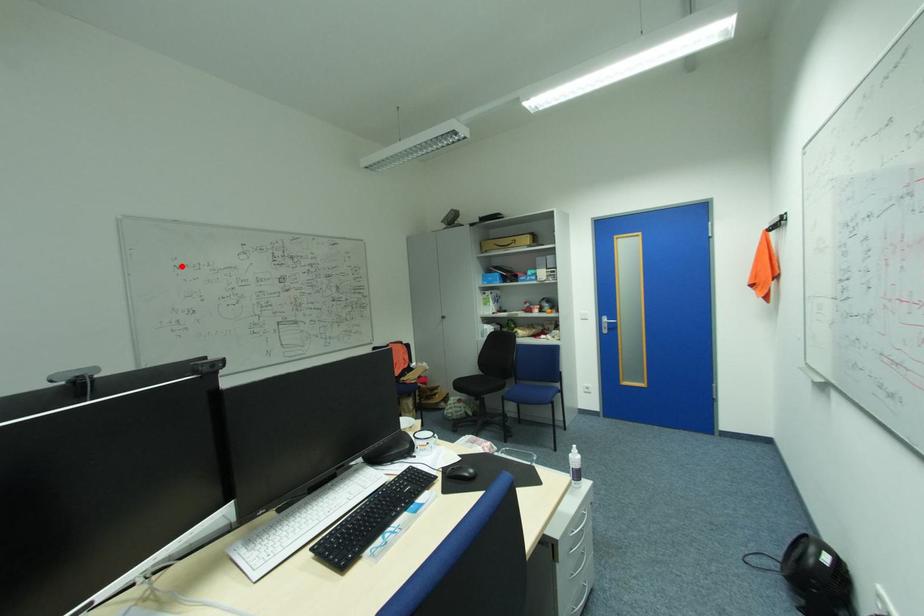
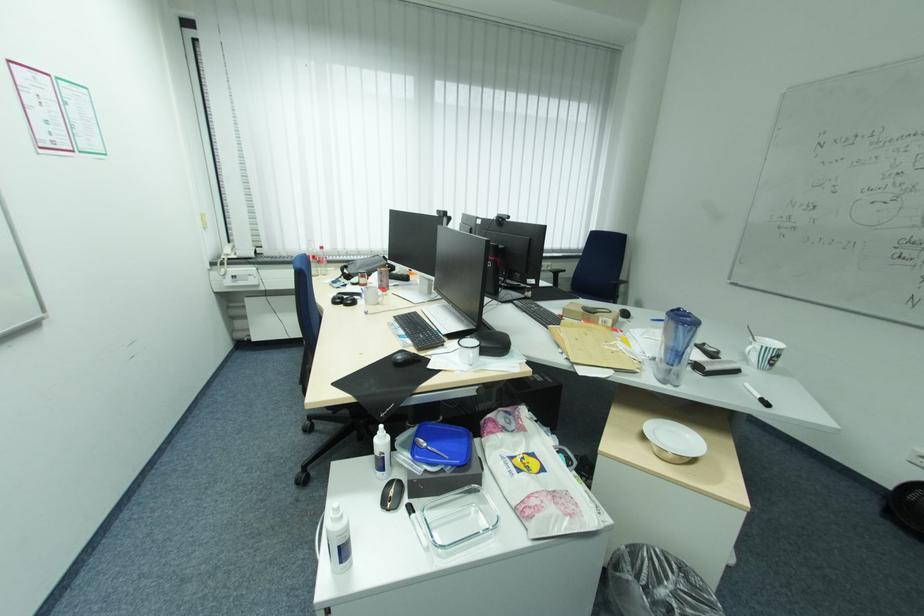
In the second image, find the point that corresponds to the highlighted location in the first image.

(827, 144)